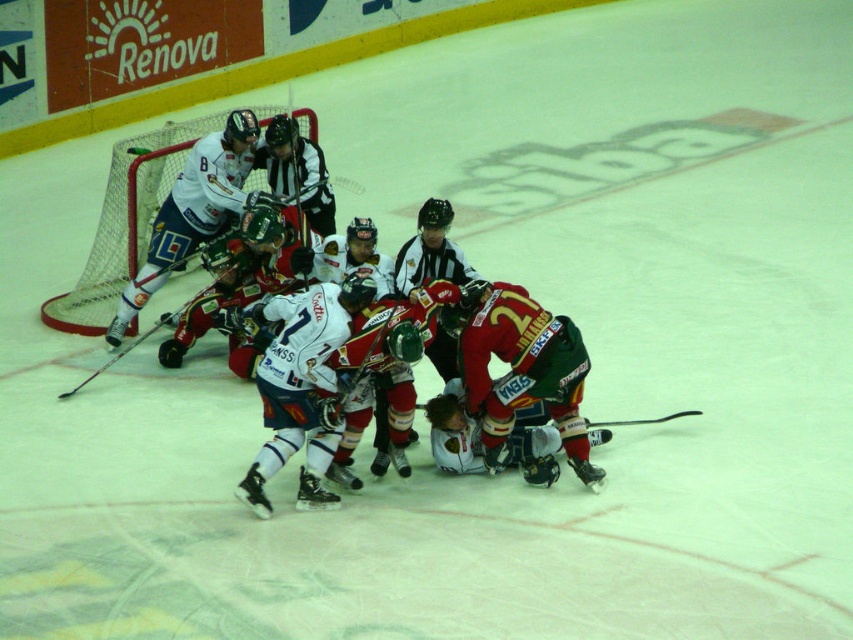
Question: Is red jersey at center thinner than white matte jersey at center?

Choices:
 (A) yes
 (B) no

Answer: (B)

Question: Estimate the real-world distances between objects in this image. Which object is farther from the white matte jersey at center?

Choices:
 (A) red jersey hockey players at center
 (B) white matte jersey at left

Answer: (B)

Question: Which point is farther to the camera?

Choices:
 (A) white matte jersey at center
 (B) red jersey hockey players at center

Answer: (B)

Question: Can you confirm if red jersey hockey players at center is positioned below white matte jersey at left?

Choices:
 (A) no
 (B) yes

Answer: (B)

Question: Which object is positioned farthest from the red jersey at center?

Choices:
 (A) white matte jersey at left
 (B) red jersey hockey players at center

Answer: (A)

Question: Can you confirm if white matte jersey at center is positioned to the left of black matte hockey stick at left?

Choices:
 (A) no
 (B) yes

Answer: (A)